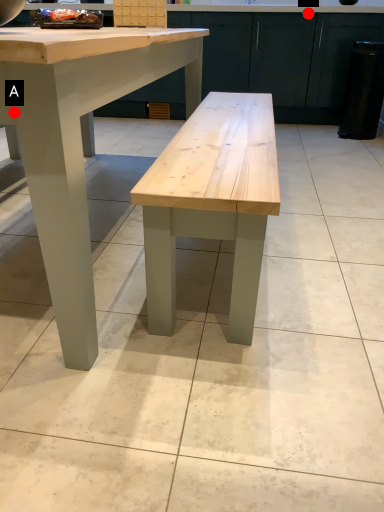
Question: Two points are circled on the image, labeled by A and B beside each circle. Which point is closer to the camera?

Choices:
 (A) A is closer
 (B) B is closer

Answer: (A)